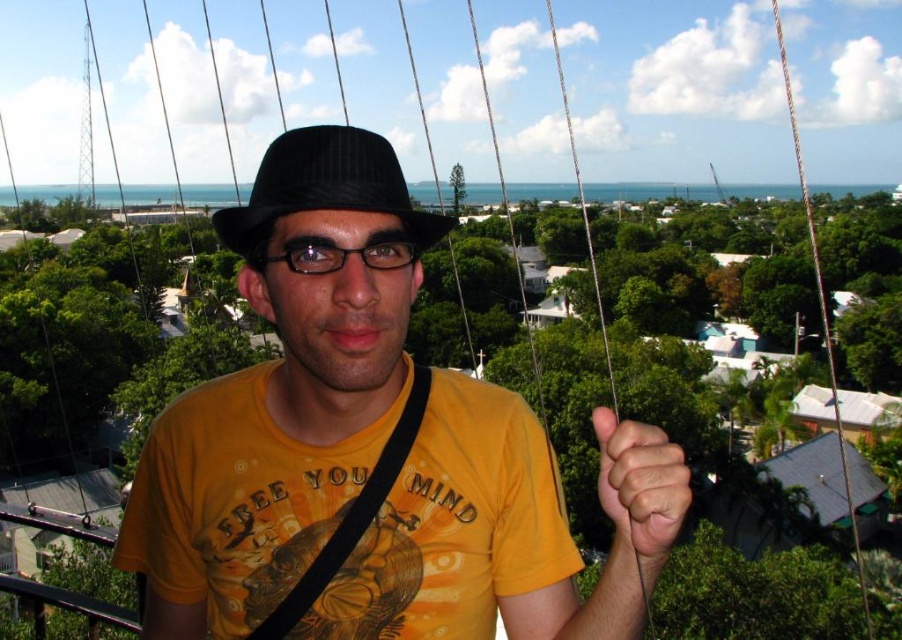
Please provide the 2D coordinates of the black pinstripe fedora at center in the image. The answer should be in the format of a coordinate pair in parentheses, such as 0.2,0.3.

The 2D coordinates of the black pinstripe fedora at center are at point (x=325, y=188).

You are a photographer trying to capture a clear shot of the distant coastal houses. You notice the black fabric strap at center and the metallic wire at upper right in your viewfinder. Which object is shorter in height when viewed from your position?

The black fabric strap at center is not as tall as the metallic wire at upper right, so the black fabric strap at center is shorter in height.

You are designing a poster for a travel agency and need to include both the black pinstripe fedora at center and the metallic wire at upper right. If the poster requires the object with the smaller width to be placed on the left side, which object should you position on the left?

The black pinstripe fedora at center has a smaller width than the metallic wire at upper right, so it should be placed on the left side of the poster.